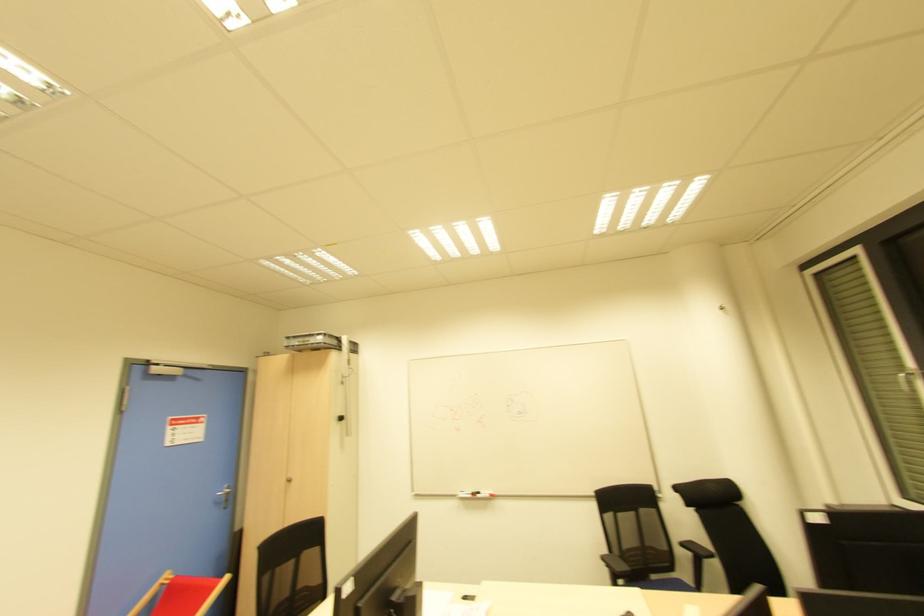
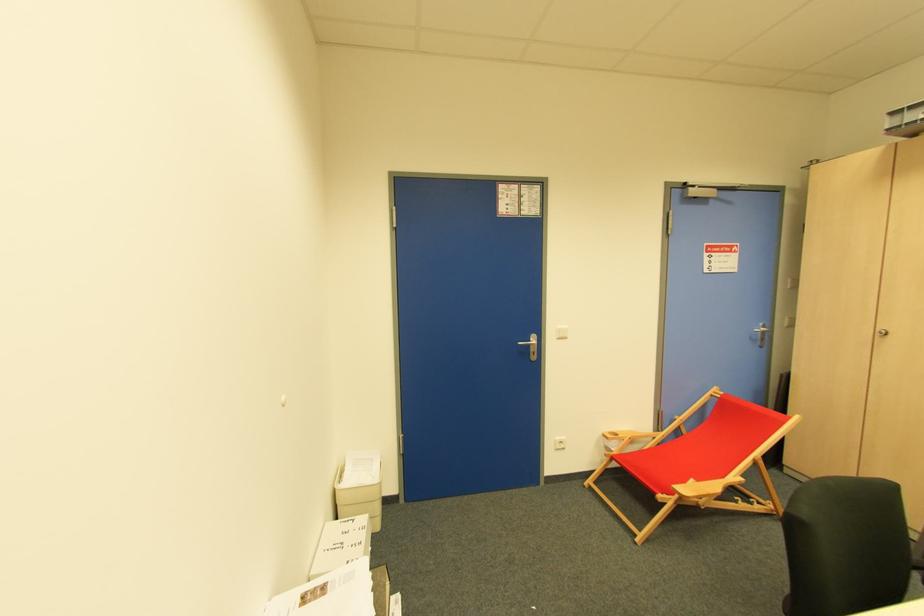
The point at (225, 493) is marked in the first image. Where is the corresponding point in the second image?

(763, 333)